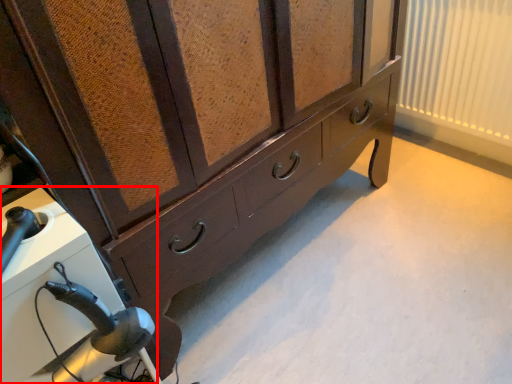
Question: Observing the image, what is the correct spatial positioning of appliance (annotated by the red box) in reference to curtain?

Choices:
 (A) right
 (B) left

Answer: (B)